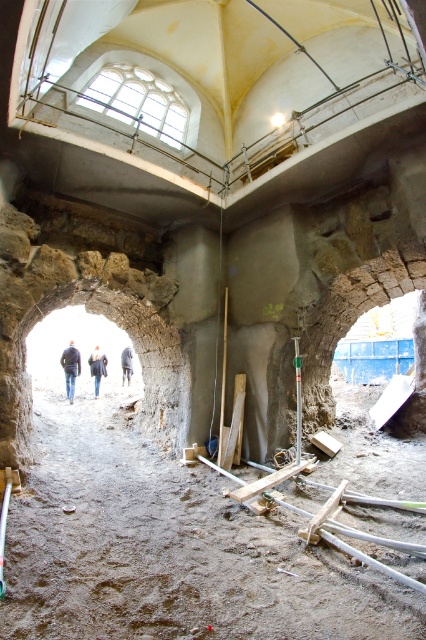
Between dirt ground at center and blue denim jacket at center, which one appears on the left side from the viewer's perspective?

From the viewer's perspective, blue denim jacket at center appears more on the left side.

Looking at this image, does dirt ground at center come behind blue denim jacket at center?

No, it is not.

Describe the element at coordinates (164, 547) in the screenshot. This screenshot has height=640, width=426. I see `dirt ground at center` at that location.

This screenshot has width=426, height=640. Identify the location of dirt ground at center. (164, 547).

Can you confirm if rough stone tunnel at center is positioned to the right of dark blue jeans at center?

Yes, rough stone tunnel at center is to the right of dark blue jeans at center.

Measure the distance between rough stone tunnel at center and camera.

A distance of 3.57 meters exists between rough stone tunnel at center and camera.

I want to click on rough stone tunnel at center, so click(131, 340).

I want to click on rough stone tunnel at center, so click(131, 340).

Which is behind, point (152, 515) or point (103, 300)?

The point (103, 300) is more distant.

Is dirt ground at center bigger than rough stone tunnel at center?

Actually, dirt ground at center might be smaller than rough stone tunnel at center.

Where is `dirt ground at center`? The width and height of the screenshot is (426, 640). dirt ground at center is located at coordinates (x=164, y=547).